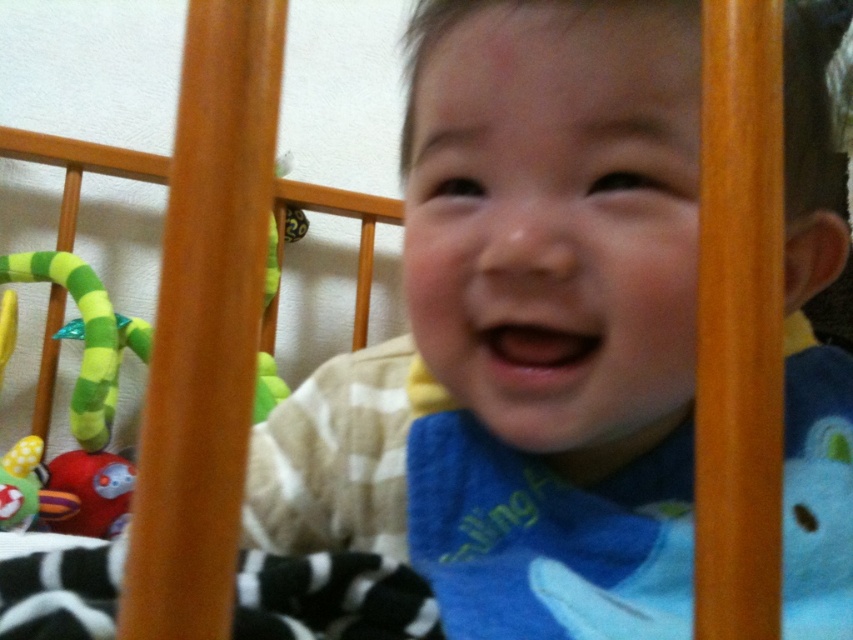
Question: Which object appears closest to the camera in this image?

Choices:
 (A) red plush toy at left
 (B) rubberized green and yellow toy at left

Answer: (B)

Question: Which of the following is the farthest from the observer?

Choices:
 (A) (33, 468)
 (B) (67, 488)

Answer: (B)

Question: Is red plush toy at left further to camera compared to rubberized green and yellow toy at left?

Choices:
 (A) no
 (B) yes

Answer: (B)

Question: Is red plush toy at left smaller than rubberized green and yellow toy at left?

Choices:
 (A) no
 (B) yes

Answer: (A)

Question: Which of the following is the farthest from the observer?

Choices:
 (A) rubberized green and yellow toy at left
 (B) red plush toy at left

Answer: (B)

Question: Does red plush toy at left appear over rubberized green and yellow toy at left?

Choices:
 (A) no
 (B) yes

Answer: (A)